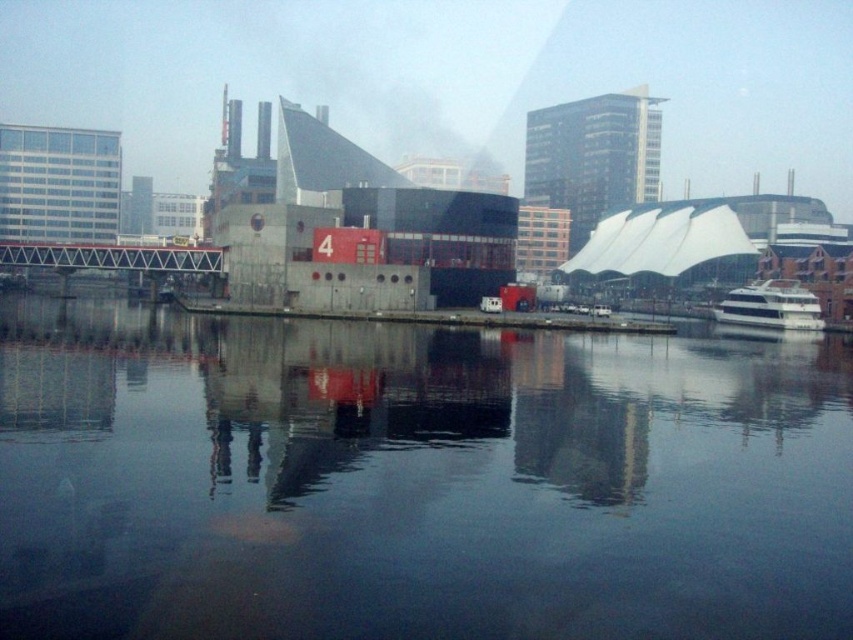
Question: Where is transparent glass water at center located in relation to white glossy boat at right in the image?

Choices:
 (A) below
 (B) above

Answer: (A)

Question: Which object is positioned closest to the red concrete building at center?

Choices:
 (A) transparent glass water at center
 (B) white glossy boat at right

Answer: (A)

Question: Observing the image, what is the correct spatial positioning of red concrete building at center in reference to white glossy boat at right?

Choices:
 (A) left
 (B) right

Answer: (A)

Question: Among these points, which one is nearest to the camera?

Choices:
 (A) (418, 195)
 (B) (808, 289)

Answer: (A)

Question: Where is transparent glass water at center located in relation to red concrete building at center in the image?

Choices:
 (A) left
 (B) right

Answer: (B)

Question: Which point is closer to the camera?

Choices:
 (A) red concrete building at center
 (B) white glossy boat at right
 (C) transparent glass water at center

Answer: (C)